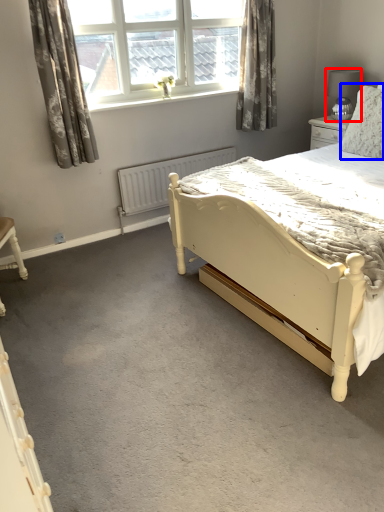
Question: Which object appears closest to the camera in this image, lamp (highlighted by a red box) or pillow (highlighted by a blue box)?

Choices:
 (A) lamp
 (B) pillow

Answer: (B)